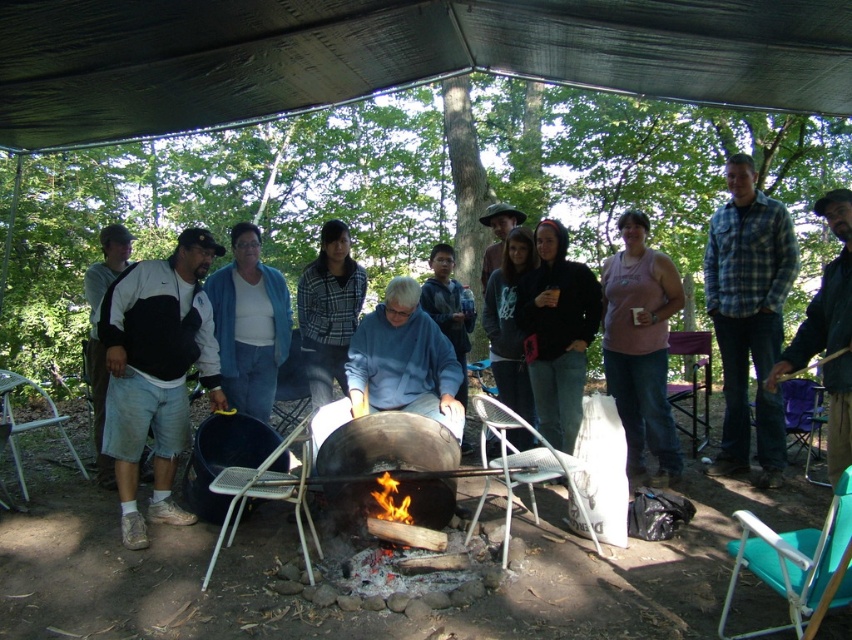
Can you confirm if pink fabric shirt at center is thinner than flamewood at center?

Incorrect, pink fabric shirt at center's width is not less than flamewood at center's.

Which is behind, point (642, 276) or point (392, 492)?

The point (642, 276) is more distant.

Locate an element on the screen. This screenshot has height=640, width=852. pink fabric shirt at center is located at coordinates (640, 346).

Can you confirm if charcoal black fire pit at center is positioned to the left of blue denim jacket at center?

No, charcoal black fire pit at center is not to the left of blue denim jacket at center.

Where is `charcoal black fire pit at center`? charcoal black fire pit at center is located at coordinates (378, 458).

Can you confirm if pink fabric shirt at center is thinner than charcoal black fire pit at center?

Indeed, pink fabric shirt at center has a lesser width compared to charcoal black fire pit at center.

Can you confirm if pink fabric shirt at center is positioned below charcoal black fire pit at center?

Incorrect, pink fabric shirt at center is not positioned below charcoal black fire pit at center.

Describe the element at coordinates (640, 346) in the screenshot. The image size is (852, 640). I see `pink fabric shirt at center` at that location.

At what (x,y) coordinates should I click in order to perform the action: click on pink fabric shirt at center. Please return your answer as a coordinate pair (x, y). Looking at the image, I should click on (640, 346).